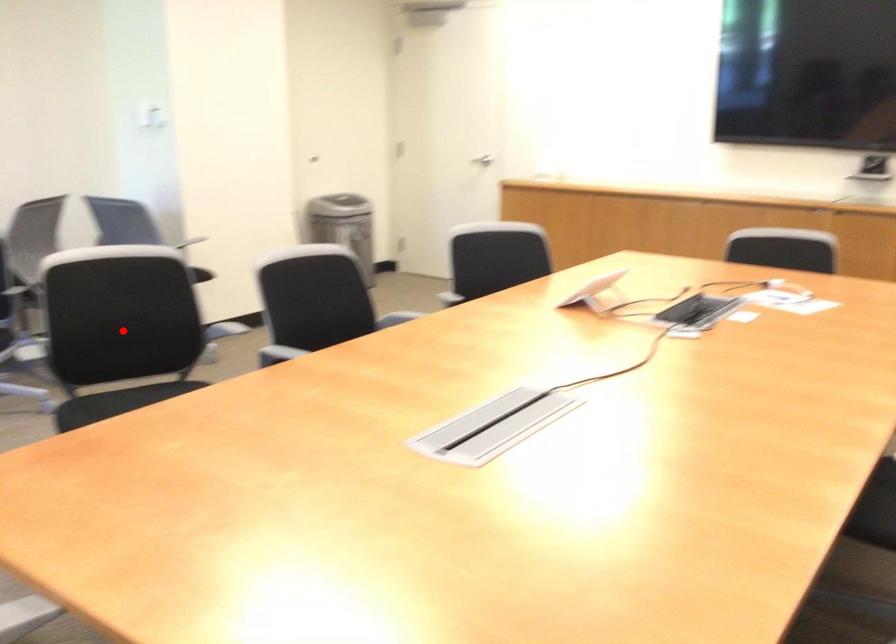
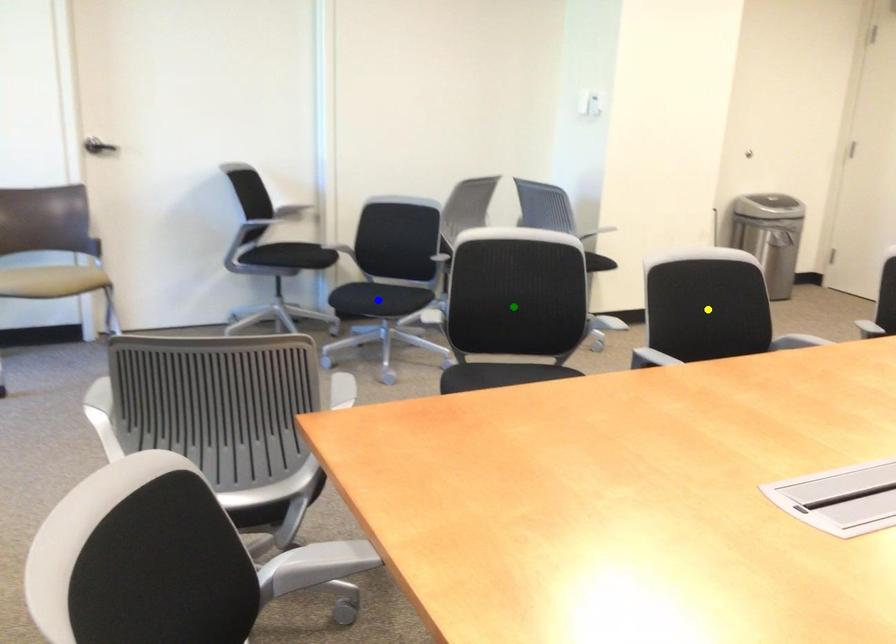
Question: I am providing you with two images of the same scene from different viewpoints. A red point is marked on the first image. You are given multiple points on the second image. Which point in image 2 is actually the same real-world point as the red point in image 1?

Choices:
 (A) blue point
 (B) green point
 (C) yellow point

Answer: (B)